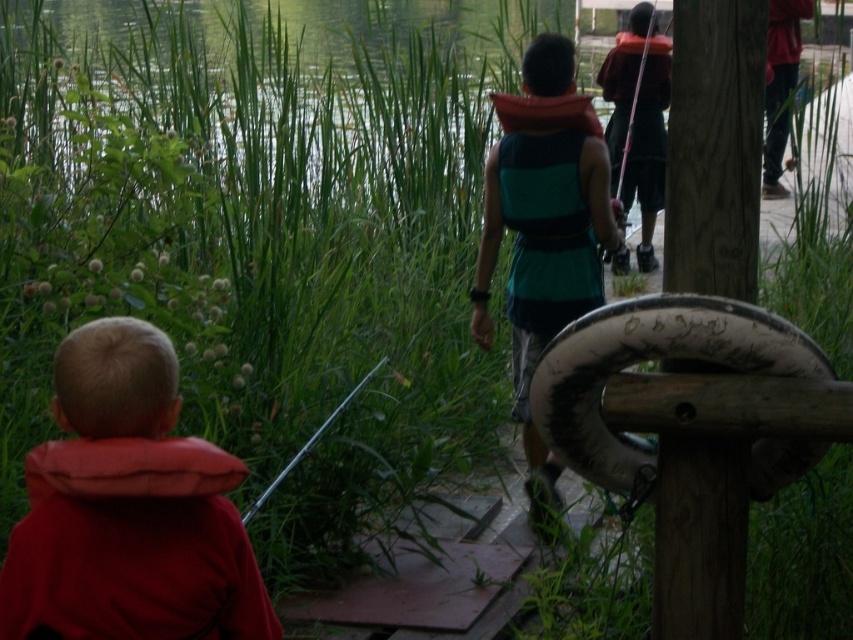
You are a photographer trying to capture a photo of the wooden post at right and the metallic silver fishing pole at lower center. To ensure both are in focus, you need to know which object is closer to you. Based on the scene description, which one is closer?

The wooden post at right is above the metallic silver fishing pole at lower center, meaning the metallic silver fishing pole at lower center is closer to you.

You are a swimmer who needs to choose between the red soft vest at left and the teal fabric life vest at center for a water activity. Which one provides more buoyancy?

The teal fabric life vest at center is thicker than the red soft vest at left, so it provides more buoyancy.

You are a visitor at the lakeside and want to place a picnic basket between the wooden post at right and the metallic silver fishing pole at lower center. Is there enough space to place the basket there?

The distance between the wooden post at right and the metallic silver fishing pole at lower center is 5.52 feet, so there is sufficient space to place the picnic basket between them.